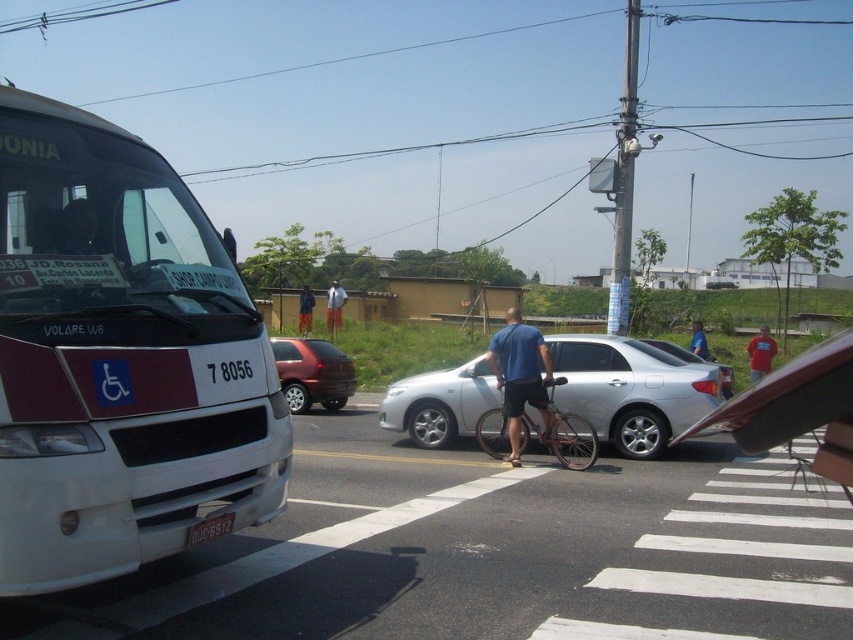
You are a delivery person needing to load a tall package onto your delivery van. The package is 1.8 meters in height. You see the silver metallic car at center and the silver metallic bicycle at center. Which object would require more vertical clearance to avoid damaging the package?

The silver metallic car at center is much taller than the silver metallic bicycle at center, so the silver metallic car at center would require more vertical clearance to avoid damaging the package.

Based on the photo, you are a delivery person needing to unload a large package from your truck. The truck is parked behind the silver metallic car at center. Can you drive forward to clear space for unloading without hitting the blue fabric pants at center?

The silver metallic car at center is larger than the blue fabric pants at center, so you can drive forward to clear space for unloading without hitting the blue fabric pants at center since the car is bigger and will provide clearance.

Consider the image. Where is the light blue shirt at center located in the image?

The light blue shirt at center is located at point coordinates of (x=334, y=307).